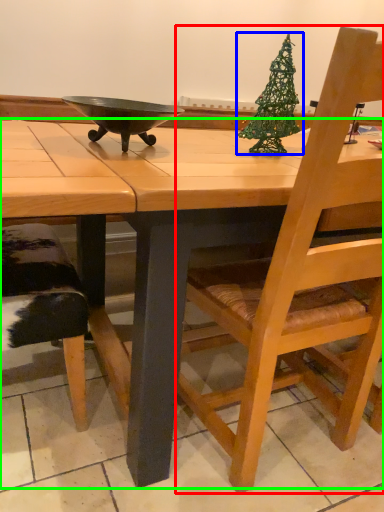
Question: Estimate the real-world distances between objects in this image. Which object is closer to chair (highlighted by a red box), christmas tree (highlighted by a blue box) or desk (highlighted by a green box)?

Choices:
 (A) christmas tree
 (B) desk

Answer: (B)